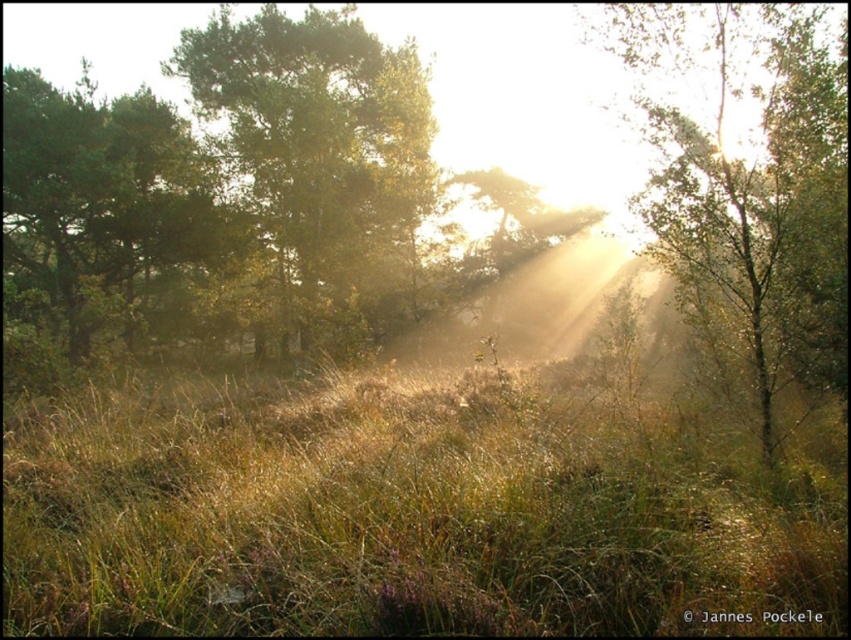
You are standing in the forest and want to walk through the green grassy area at center. Considering the width of the green grassy at center compared to the green matte tree at center, do you think you can pass through it without touching the tree?

The green grassy at center has a width that is less than the green matte tree at center, so it might be challenging to pass through the green grassy at center without touching the tree since it is narrower than the tree.

You are standing in the forest and see two points marked in the image. The first point is at coordinate point [820,116] and the second is at point [67,138]. Which point is closer to you?

Point [820,116] is in front of point [67,138], so the first point is closer to you.

You are standing in the forest and want to walk towards the green leafy tree at center and the green matte tree at left. Which tree will you reach first?

You will reach the green leafy tree at center first because it is closer to you than the green matte tree at left.